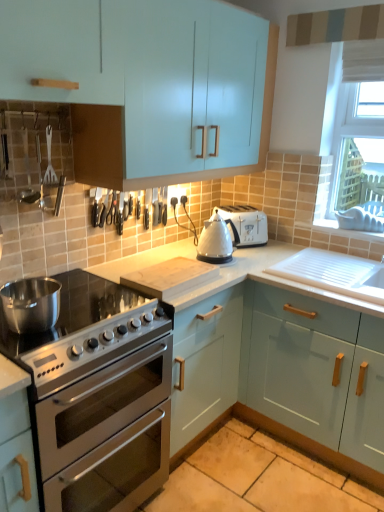
The width and height of the screenshot is (384, 512). I want to click on free area below white glossy kettle at center, which is counted as the 1th appliance, starting from the top (from a real-world perspective), so click(221, 261).